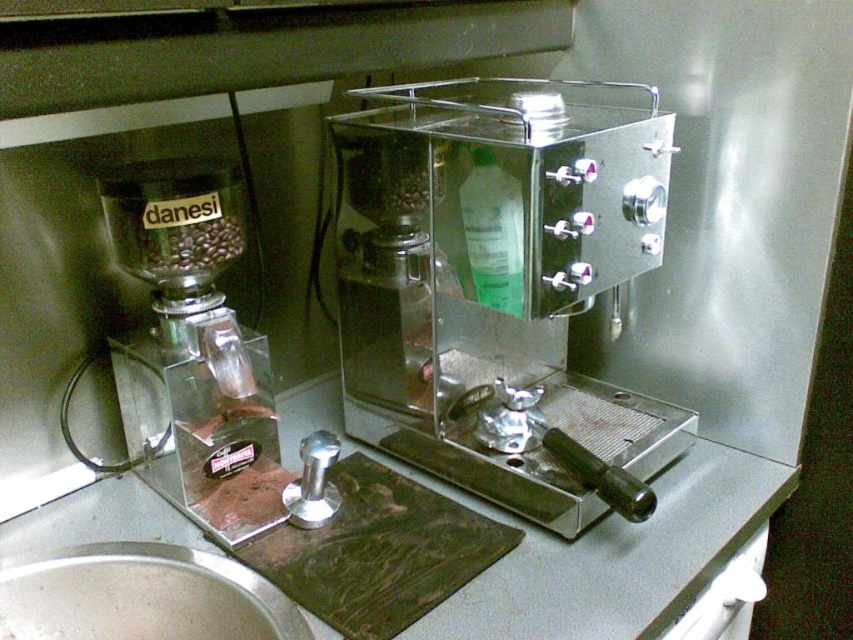
You are a barista preparing to clean the polished stainless steel espresso machine at center and the matte black grinder at left. Which of these two items is positioned higher up in the image?

The polished stainless steel espresso machine at center is positioned higher up than the matte black grinder at left.

You are a barista preparing to clean the polished stainless steel espresso machine at center and the silver metallic sink at lower left. Which one requires more time to clean because of its size?

The polished stainless steel espresso machine at center requires more time to clean because it is larger in size than the silver metallic sink at lower left.

You are setting up a coffee station and need to place the Danesi grinder on the left and the polished stainless steel espresso machine at center. According to the layout, where should you position the espresso machine relative to the grinder?

The polished stainless steel espresso machine at center is located at point (x=502, y=285), so it should be positioned at the center of the setup relative to the Danesi grinder on the left.